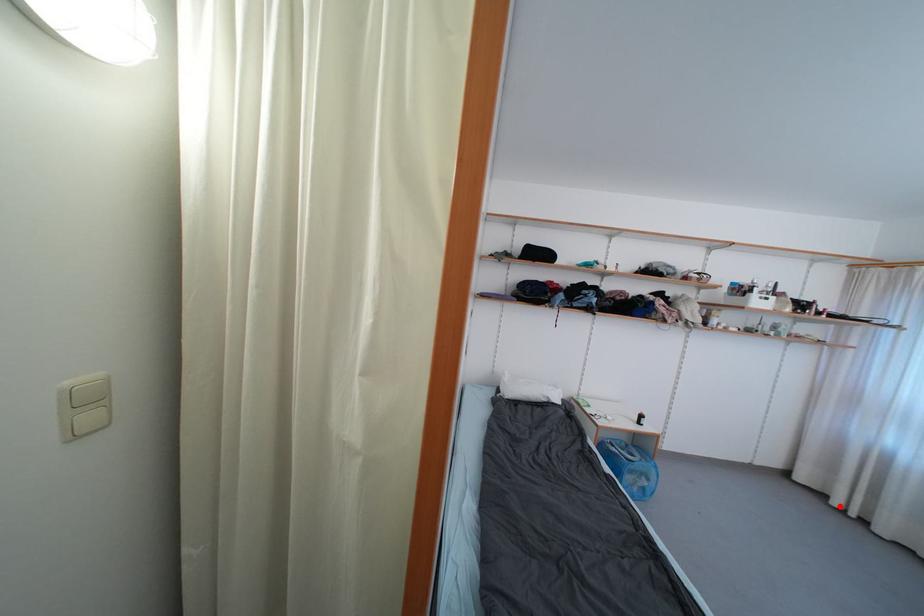
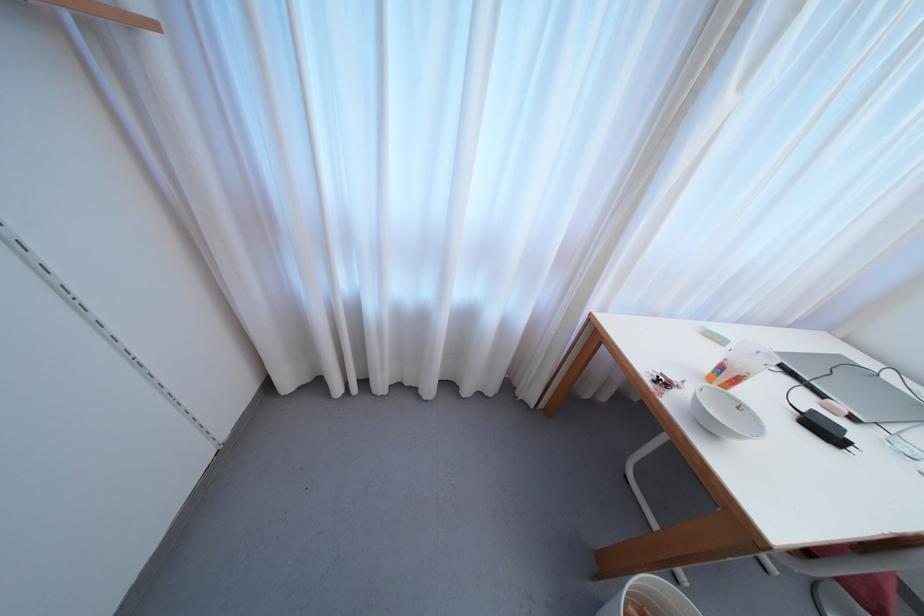
Find the pixel in the second image that matches the highlighted location in the first image.

(342, 392)